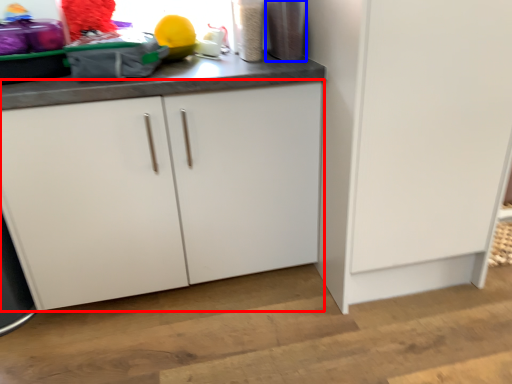
Question: Which object is further to the camera taking this photo, cabinetry (highlighted by a red box) or appliance (highlighted by a blue box)?

Choices:
 (A) cabinetry
 (B) appliance

Answer: (B)